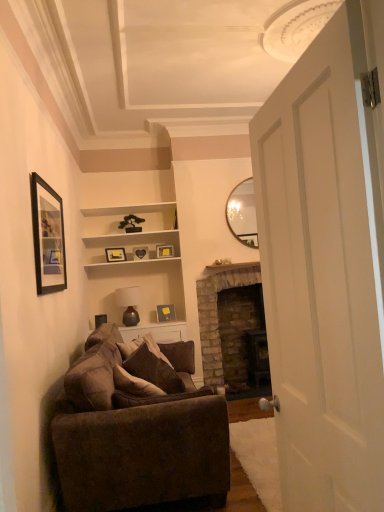
The image size is (384, 512). Describe the element at coordinates (131, 223) in the screenshot. I see `green leafy plant at upper center` at that location.

Identify the location of velvet brown couch at left. (138, 428).

At what (x,y) coordinates should I click in order to perform the action: click on matte gold picture frame at center, the first picture frame viewed from the back. Please return your answer as a coordinate pair (x, y). The width and height of the screenshot is (384, 512). Looking at the image, I should click on (164, 251).

This screenshot has width=384, height=512. Describe the element at coordinates (324, 273) in the screenshot. I see `white matte door at right` at that location.

I want to click on white matte door at right, so click(x=324, y=273).

This screenshot has height=512, width=384. Identify the location of green leafy plant at upper center. (131, 223).

From a real-world perspective, is velvet brown couch at left physically located above or below brick fireplace at center?

In terms of real-world spatial position, velvet brown couch at left is below brick fireplace at center.

Is velvet brown couch at left positioned with its back to brick fireplace at center?

No, velvet brown couch at left's orientation is not away from brick fireplace at center.

In the scene shown: Which object is thinner, velvet brown couch at left or brick fireplace at center?

Thinner between the two is brick fireplace at center.

Find the location of a particular element. fireplace lying above the velvet brown couch at left (from the image's perspective) is located at coordinates (217, 314).

Is black matte picture frame at upper left, marked as the 6th picture frame in a bottom-to-top arrangement, located within white matte door at right?

No, white matte door at right does not contain black matte picture frame at upper left, marked as the 6th picture frame in a bottom-to-top arrangement.

Can you confirm if white matte door at right is thinner than black matte picture frame at upper left, marked as the 6th picture frame in a bottom-to-top arrangement?

No.

Does white matte door at right turn towards black matte picture frame at upper left, acting as the 6th picture frame starting from the back?

No, white matte door at right does not turn towards black matte picture frame at upper left, acting as the 6th picture frame starting from the back.

From the image's perspective, between white matte door at right and black matte picture frame at upper left, placed as the 1th picture frame when sorted from top to bottom, which one is located above?

From the image's view, black matte picture frame at upper left, placed as the 1th picture frame when sorted from top to bottom, is above.

Considering the positions of objects matte gold picture frame at center, acting as the fifth picture frame starting from the bottom, and matte gold picture frame at center, which is counted as the 2th picture frame, starting from the back, in the image provided, who is more to the left, matte gold picture frame at center, acting as the fifth picture frame starting from the bottom, or matte gold picture frame at center, which is counted as the 2th picture frame, starting from the back,?

Positioned to the left is matte gold picture frame at center, acting as the fifth picture frame starting from the bottom.

From the picture: From a real-world perspective, is matte gold picture frame at center, acting as the fifth picture frame starting from the bottom, positioned under matte gold picture frame at center, marked as the fifth picture frame in a front-to-back arrangement, based on gravity?

Incorrect, from a real-world perspective, matte gold picture frame at center, acting as the fifth picture frame starting from the bottom, is higher than matte gold picture frame at center, marked as the fifth picture frame in a front-to-back arrangement.

Who is smaller, matte gold picture frame at center, acting as the fifth picture frame starting from the bottom, or matte gold picture frame at center, which is counted as the 2th picture frame, starting from the back?

matte gold picture frame at center, acting as the fifth picture frame starting from the bottom.

Which object is positioned more to the left, matte black picture frame at lower left, which ranks as the 5th picture frame in back-to-front order, or green leafy plant at upper center?

Positioned to the left is matte black picture frame at lower left, which ranks as the 5th picture frame in back-to-front order.

Consider the image. Would you say matte black picture frame at lower left, acting as the 2th picture frame starting from the front, is outside green leafy plant at upper center?

Yes.

Could you tell me if matte black picture frame at lower left, the first picture frame ordered from the bottom, is facing green leafy plant at upper center?

No, matte black picture frame at lower left, the first picture frame ordered from the bottom, does not turn towards green leafy plant at upper center.

From a real-world perspective, which object stands above the other?

In real-world perspective, matte gold picture frame at center, the fourth picture frame from the front, is above.

Which is more to the right, matte gold picture frame at center, the third picture frame from the back, or matte black picture frame at lower left, acting as the 2th picture frame starting from the front?

matte gold picture frame at center, the third picture frame from the back.

Could you tell me if matte gold picture frame at center, the fourth picture frame from the front, is facing matte black picture frame at lower left, the 6th picture frame when ordered from top to bottom?

No, matte gold picture frame at center, the fourth picture frame from the front, is not oriented towards matte black picture frame at lower left, the 6th picture frame when ordered from top to bottom.

Is matte brown glass lamp at center bigger or smaller than white matte door at right?

Considering their sizes, matte brown glass lamp at center takes up less space than white matte door at right.

Is matte brown glass lamp at center in contact with white matte door at right?

There is a gap between matte brown glass lamp at center and white matte door at right.

Is matte brown glass lamp at center aimed at white matte door at right?

Yes, matte brown glass lamp at center faces towards white matte door at right.

Considering the sizes of white matte door at right and matte black picture frame at lower left, acting as the 2th picture frame starting from the front, in the image, is white matte door at right wider or thinner than matte black picture frame at lower left, acting as the 2th picture frame starting from the front,?

white matte door at right is wider than matte black picture frame at lower left, acting as the 2th picture frame starting from the front.

From the image's perspective, would you say white matte door at right is positioned over matte black picture frame at lower left, which ranks as the 5th picture frame in back-to-front order?

Indeed, from the image's perspective, white matte door at right is shown above matte black picture frame at lower left, which ranks as the 5th picture frame in back-to-front order.

Can you confirm if white matte door at right is shorter than matte black picture frame at lower left, acting as the 2th picture frame starting from the front?

No.

Consider the image. Is white matte door at right at the left side of matte black picture frame at lower left, the first picture frame ordered from the bottom?

No.

Find the location of a particular element. The image size is (384, 512). fireplace behind the velvet brown couch at left is located at coordinates (217, 314).

From a real-world perspective, count 4th picture frames upward from the white matte door at right and point to it. Please provide its 2D coordinates.

[(48, 237)]

From the image, which object appears to be farther from matte gold picture frame at center, marked as the fifth picture frame in a front-to-back arrangement, brown fabric pillow at center or black matte picture frame at upper left, placed as the 1th picture frame when sorted from top to bottom?

black matte picture frame at upper left, placed as the 1th picture frame when sorted from top to bottom, is positioned further to the anchor matte gold picture frame at center, marked as the fifth picture frame in a front-to-back arrangement.

Which object lies nearer to the anchor point brown fabric pillow at center, matte gold picture frame at center, the fourth picture frame from the back, or velvet brown couch at left?

Based on the image, velvet brown couch at left appears to be nearer to brown fabric pillow at center.

From the image, which object appears to be farther from matte gold picture frame at center, the fourth picture frame from the front, white matte shelves at upper center or brown fabric pillow at center?

The object further to matte gold picture frame at center, the fourth picture frame from the front, is brown fabric pillow at center.

From the image, which object appears to be nearer to matte gold picture frame at center, the third picture frame from the back, velvet brown couch at left or green leafy plant at upper center?

green leafy plant at upper center is closer to matte gold picture frame at center, the third picture frame from the back.

Considering their positions, is matte gold picture frame at center, the fourth picture frame from the back, positioned closer to velvet brown couch at left than green leafy plant at upper center?

The object closer to velvet brown couch at left is matte gold picture frame at center, the fourth picture frame from the back.

From the image, which object appears to be nearer to black matte picture frame at upper left, marked as the 6th picture frame in a bottom-to-top arrangement, green leafy plant at upper center or matte brown glass lamp at center?

green leafy plant at upper center.

Which object lies further to the anchor point matte black picture frame at lower left, the first picture frame ordered from the bottom, white matte door at right or matte gold picture frame at center, marked as the fifth picture frame in a front-to-back arrangement?

white matte door at right is positioned further to the anchor matte black picture frame at lower left, the first picture frame ordered from the bottom.

Based on their spatial positions, is matte gold picture frame at center, the third picture frame in the front-to-back sequence, or brick fireplace at center further from brown fabric pillow at center?

matte gold picture frame at center, the third picture frame in the front-to-back sequence.

Image resolution: width=384 pixels, height=512 pixels. I want to click on shelf between black matte picture frame at upper left, acting as the 6th picture frame starting from the back, and matte gold picture frame at center, the fourth picture frame from the back, from front to back, so [128, 234].

Where is `lamp between white matte door at right and matte gold picture frame at center, the fourth picture frame from the front, along the z-axis`? The width and height of the screenshot is (384, 512). lamp between white matte door at right and matte gold picture frame at center, the fourth picture frame from the front, along the z-axis is located at coordinates (129, 304).

Identify the location of picture frame positioned between velvet brown couch at left and matte black picture frame at lower left, the 6th picture frame when ordered from top to bottom, from near to far. The height and width of the screenshot is (512, 384). (48, 237).

Locate an element on the screen. The height and width of the screenshot is (512, 384). studio couch located between white matte door at right and brown fabric pillow at center in the depth direction is located at coordinates (138, 428).